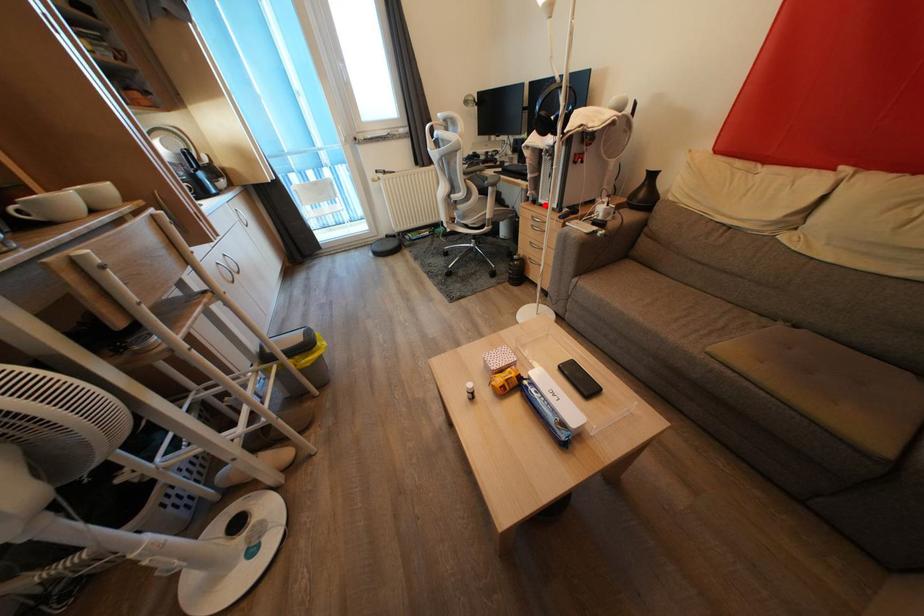
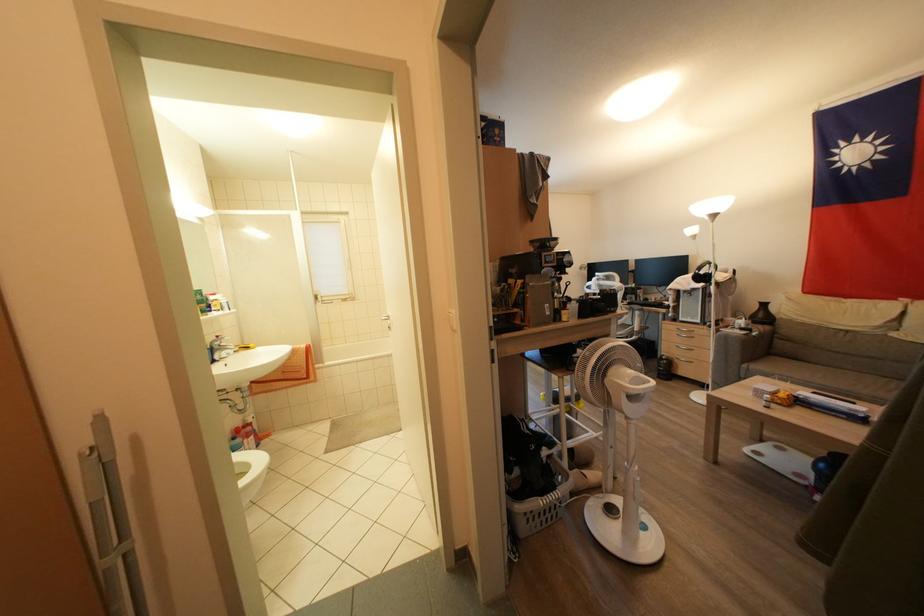
Question: I am providing you with two images of the same scene from different viewpoints. In image1, a red point is highlighted. Considering the same 3D point in image2, which of the following is correct?

Choices:
 (A) It is closer
 (B) It is farther

Answer: (B)